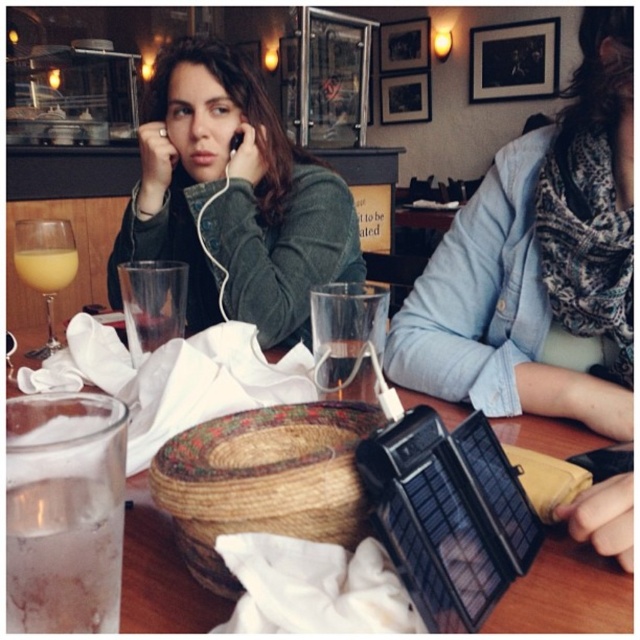
Which is more to the left, green fuzzy sweater at upper center or translucent glass at center?

green fuzzy sweater at upper center

Can you confirm if green fuzzy sweater at upper center is positioned above translucent glass at center?

Indeed, green fuzzy sweater at upper center is positioned over translucent glass at center.

Where is `green fuzzy sweater at upper center`? The width and height of the screenshot is (640, 640). green fuzzy sweater at upper center is located at coordinates pos(234,198).

Image resolution: width=640 pixels, height=640 pixels. In order to click on green fuzzy sweater at upper center in this screenshot , I will do `click(234, 198)`.

Between wooden table at center and yellow liquid at upper left, which one appears on the right side from the viewer's perspective?

From the viewer's perspective, wooden table at center appears more on the right side.

Which is in front, point (131, 589) or point (45, 257)?

Positioned in front is point (131, 589).

Is point (172, 566) positioned in front of point (26, 262)?

That is True.

This screenshot has width=640, height=640. In order to click on wooden table at center in this screenshot , I will do `click(566, 593)`.

Which of these two, green fuzzy sweater at upper center or yellow liquid at upper left, stands taller?

Standing taller between the two is green fuzzy sweater at upper center.

Which is behind, point (317, 280) or point (58, 285)?

The point (317, 280) is behind.

The width and height of the screenshot is (640, 640). What do you see at coordinates (234, 198) in the screenshot?
I see `green fuzzy sweater at upper center` at bounding box center [234, 198].

Where is `green fuzzy sweater at upper center`? green fuzzy sweater at upper center is located at coordinates (234, 198).